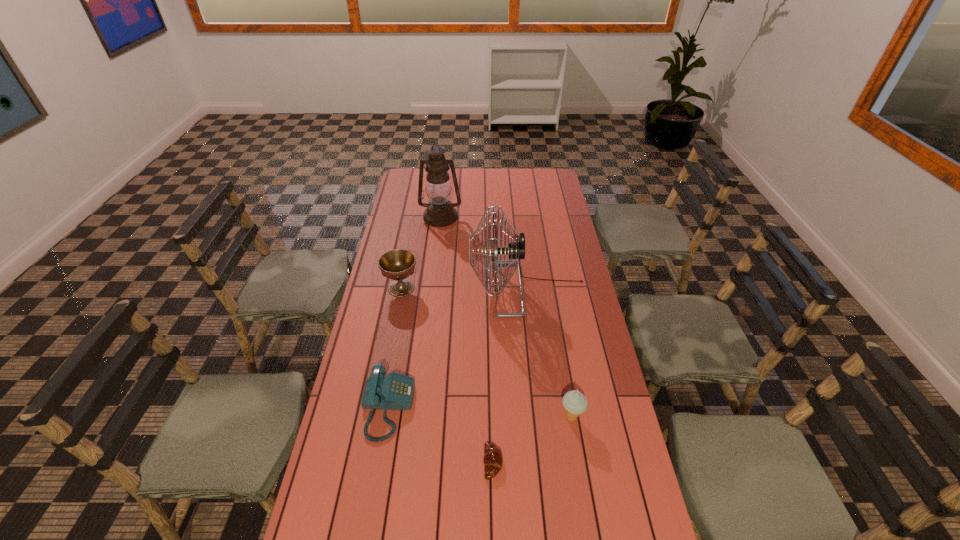
At what (x,y) coordinates should I click in order to perform the action: click on vacant space that satisfies the following two spatial constraints: 1. on the back side of the nearest object; 2. on the right side of the icecream. Please return your answer as a coordinate pair (x, y). The width and height of the screenshot is (960, 540). Looking at the image, I should click on (492, 417).

You are a GUI agent. You are given a task and a screenshot of the screen. Output one action in this format:
    pyautogui.click(x=<x>, y=<y>)
    Task: Click on the vacant region that satisfies the following two spatial constraints: 1. on the dial of the telephone; 2. on the back side of the crescent roll
    This screenshot has height=540, width=960.
    Given the screenshot: What is the action you would take?
    pyautogui.click(x=378, y=463)

Where is `vacant space that satisfies the following two spatial constraints: 1. on the front side of the chalice; 2. on the left side of the icecream`? The width and height of the screenshot is (960, 540). vacant space that satisfies the following two spatial constraints: 1. on the front side of the chalice; 2. on the left side of the icecream is located at coordinates 376,417.